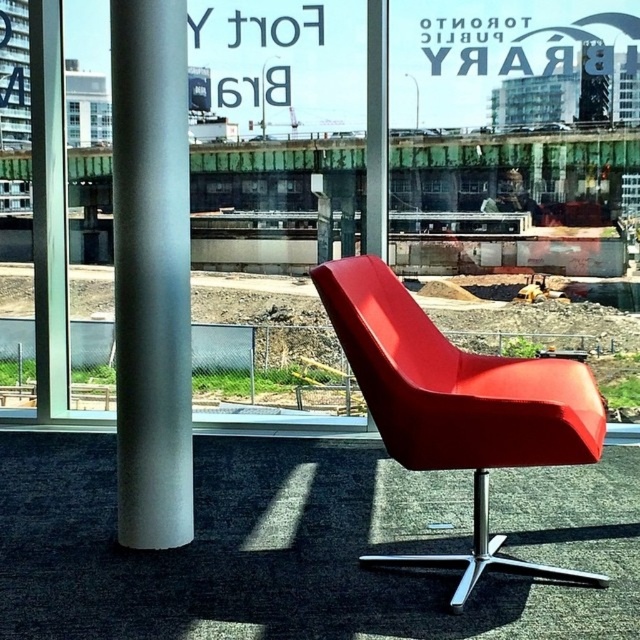
You are a delivery person trying to place a package between the satin silver pole at left and the matte red swivel chair at center. The package measures 24 inches in length. Can you fit the package between them?

The satin silver pole at left and matte red swivel chair at center are 25.82 inches apart. Since the package is 24 inches long, it can fit between them with about 1.82 inches of space remaining.

You are standing in the room and want to move from the satin silver pole at left to the matte red swivel chair at center. Which object will you encounter first as you move towards the chair?

You will encounter the satin silver pole at left first because it is closer to you than the matte red swivel chair at center, so you must pass by it before reaching the chair.

You are planning to rearrange the furniture in the room and need to know which object takes up more floor space. Which one between the satin silver pole at left and the matte red swivel chair at center requires more space?

The satin silver pole at left occupies less space than the matte red swivel chair at center, so the matte red swivel chair at center requires more floor space.